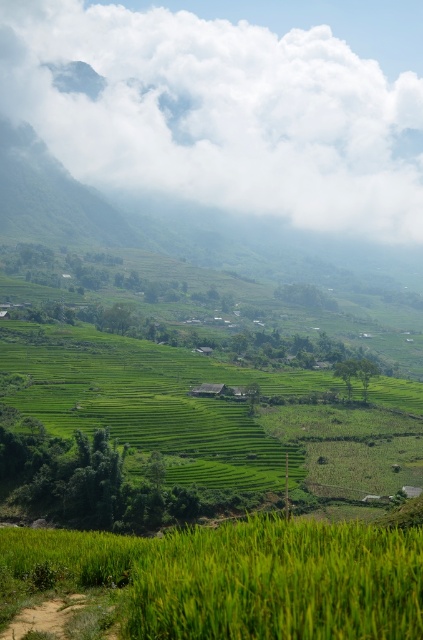
Is point (376, 476) farther from viewer compared to point (409, 554)?

Yes.

Is green grassy field at center bigger than green grassy rice field at lower center?

Correct, green grassy field at center is larger in size than green grassy rice field at lower center.

Is point (164, 465) positioned in front of point (151, 566)?

No.

The image size is (423, 640). What are the coordinates of `green grassy field at center` in the screenshot? It's located at (186, 433).

Does white fluffy cloud at upper center have a greater width compared to green grassy rice field at lower center?

Yes, white fluffy cloud at upper center is wider than green grassy rice field at lower center.

Is point (192, 84) positioned in front of point (114, 557)?

No, it is not.

Is point (409, 125) less distant than point (286, 632)?

No, it is not.

At what (x,y) coordinates should I click in order to perform the action: click on white fluffy cloud at upper center. Please return your answer as a coordinate pair (x, y). Image resolution: width=423 pixels, height=640 pixels. Looking at the image, I should click on (219, 113).

Image resolution: width=423 pixels, height=640 pixels. What do you see at coordinates (219, 113) in the screenshot? I see `white fluffy cloud at upper center` at bounding box center [219, 113].

Measure the distance between point (156, 60) and camera.

The distance of point (156, 60) from camera is 806.58 meters.

Where is `white fluffy cloud at upper center`? This screenshot has width=423, height=640. white fluffy cloud at upper center is located at coordinates (219, 113).